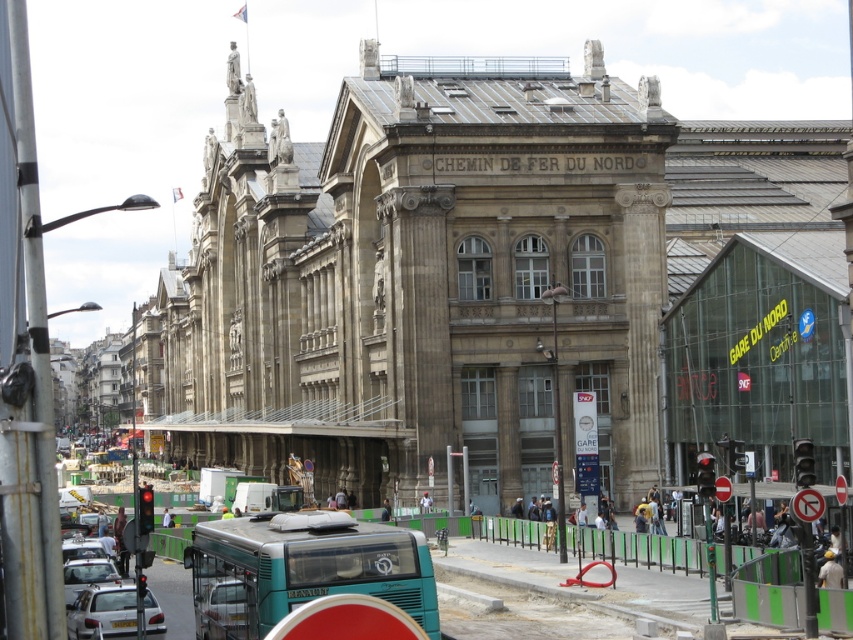
Between point (242, 612) and point (67, 602), which one is positioned behind?

The point (67, 602) is behind.

Does point (229, 621) lie behind point (68, 602)?

No, (229, 621) is closer to viewer.

Locate an element on the screen. The width and height of the screenshot is (853, 640). silver metallic car at lower left is located at coordinates (224, 609).

Does silver metallic sedan at lower left appear on the left side of silver metallic car at lower left?

Correct, you'll find silver metallic sedan at lower left to the left of silver metallic car at lower left.

Does point (154, 605) come closer to viewer compared to point (216, 624)?

No, (154, 605) is behind (216, 624).

Is point (119, 624) behind point (233, 628)?

Yes, it is behind point (233, 628).

At what (x,y) coordinates should I click in order to perform the action: click on silver metallic sedan at lower left. Please return your answer as a coordinate pair (x, y). The width and height of the screenshot is (853, 640). Looking at the image, I should click on (102, 612).

At what (x,y) coordinates should I click in order to perform the action: click on silver metallic sedan at lower left. Please return your answer as a coordinate pair (x, y). The height and width of the screenshot is (640, 853). Looking at the image, I should click on (102, 612).

Is silver metallic sedan at lower left shorter than matte silver car at lower left?

No.

Identify the location of silver metallic sedan at lower left. The height and width of the screenshot is (640, 853). (102, 612).

Where is `silver metallic sedan at lower left`? This screenshot has width=853, height=640. silver metallic sedan at lower left is located at coordinates (102, 612).